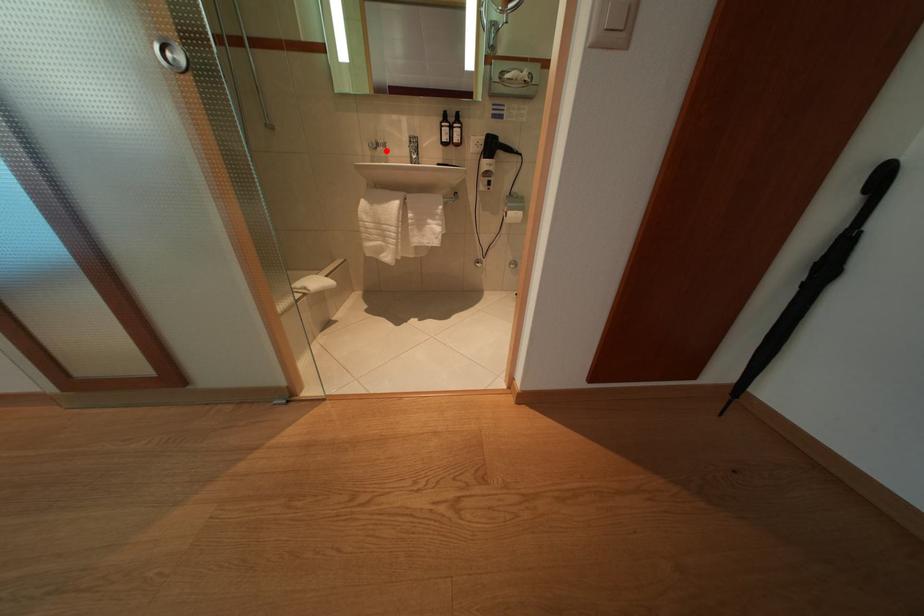
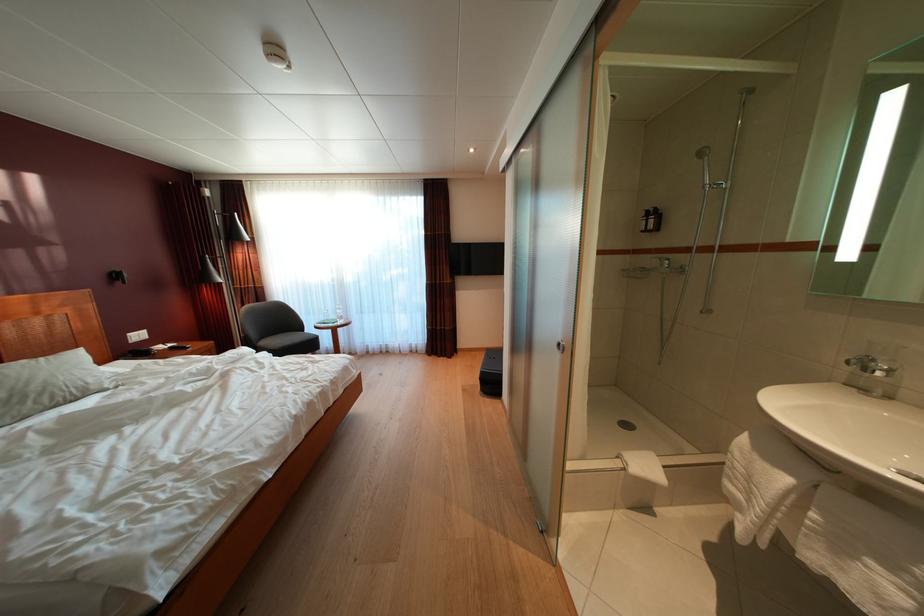
Question: I am providing you with two images of the same scene from different viewpoints. Image1 has a red point marked. In image2, the corresponding 3D location appears at what relative position? Reply with the corresponding letter.

Choices:
 (A) Closer
 (B) Farther

Answer: (B)